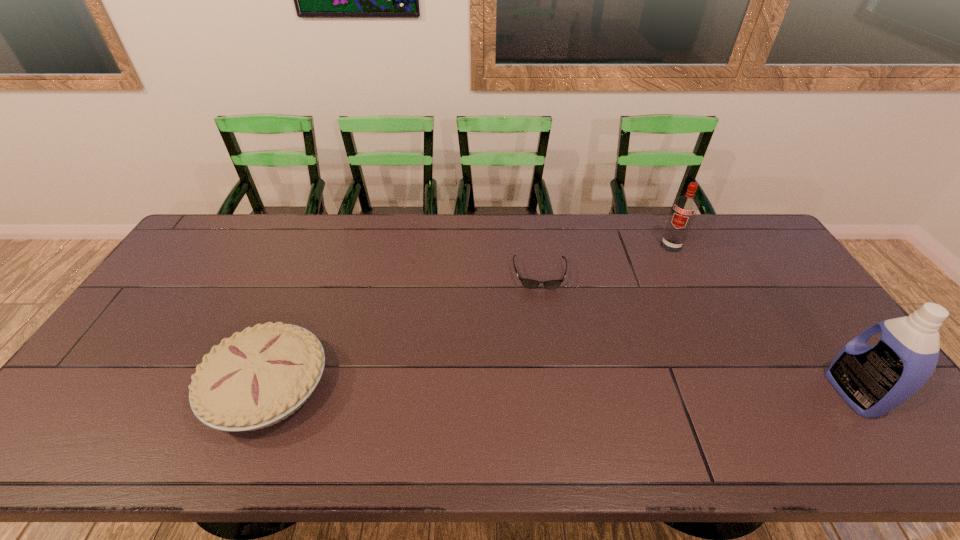
What are the coordinates of `unoccupied position between the vodka and the tallest object` in the screenshot? It's located at (762, 320).

Locate an element on the screen. free space between the vodka and the leftmost object is located at coordinates [469, 316].

Locate an element on the screen. empty location between the second object from left to right and the farthest object is located at coordinates (606, 260).

Locate an element on the screen. The width and height of the screenshot is (960, 540). vacant area between the sunglasses and the vodka is located at coordinates (606, 260).

Find the location of a particular element. This screenshot has width=960, height=540. vacant space that's between the sunglasses and the farthest object is located at coordinates (606, 260).

Locate an element on the screen. The height and width of the screenshot is (540, 960). vacant space that is in between the second shortest object and the shortest object is located at coordinates (404, 330).

The image size is (960, 540). In order to click on object that is the third closest to the sunglasses in this screenshot , I will do `click(873, 380)`.

I want to click on the third closest object relative to the pie, so click(873, 380).